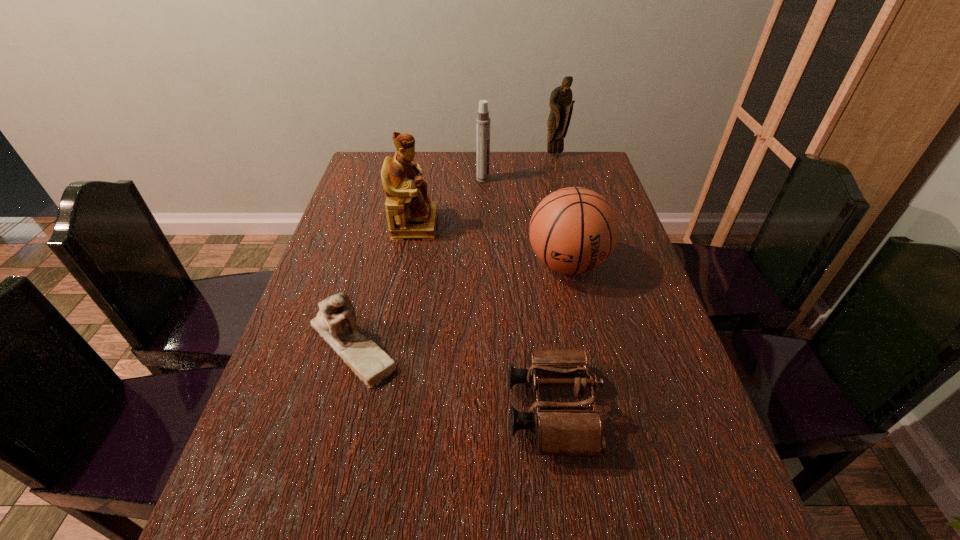
At what (x,y) coordinates should I click in order to perform the action: click on the rightmost figurine. Please return your answer as a coordinate pair (x, y). Looking at the image, I should click on (561, 104).

Identify the location of the farthest figurine. The width and height of the screenshot is (960, 540). (561, 104).

Locate an element on the screen. This screenshot has width=960, height=540. the second farthest figurine is located at coordinates (411, 214).

At what (x,y) coordinates should I click in order to perform the action: click on aerosol can. Please return your answer as a coordinate pair (x, y). This screenshot has width=960, height=540. Looking at the image, I should click on (482, 121).

You are a GUI agent. You are given a task and a screenshot of the screen. Output one action in this format:
    pyautogui.click(x=<x>, y=<y>)
    Task: Click on the third object from left to right
    The image size is (960, 540).
    Given the screenshot: What is the action you would take?
    pyautogui.click(x=482, y=121)

Image resolution: width=960 pixels, height=540 pixels. Find the location of `basketball`. basketball is located at coordinates (574, 230).

The width and height of the screenshot is (960, 540). I want to click on the second shortest object, so click(335, 322).

Locate an element on the screen. the shortest figurine is located at coordinates (335, 322).

Identify the location of binoculars. The width and height of the screenshot is (960, 540). (561, 429).

I want to click on vacant space located 0.260m on the front-facing side of the rightmost figurine, so click(x=566, y=199).